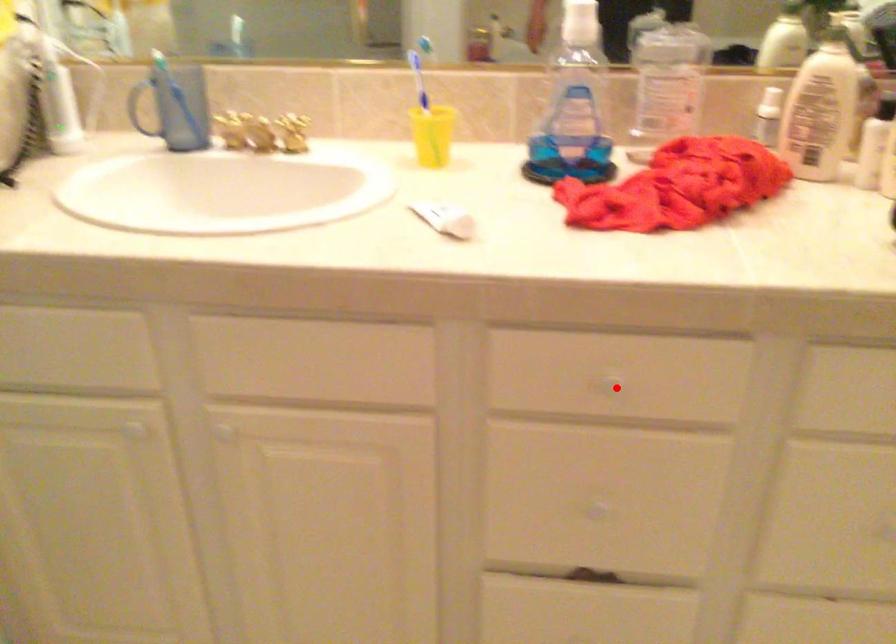
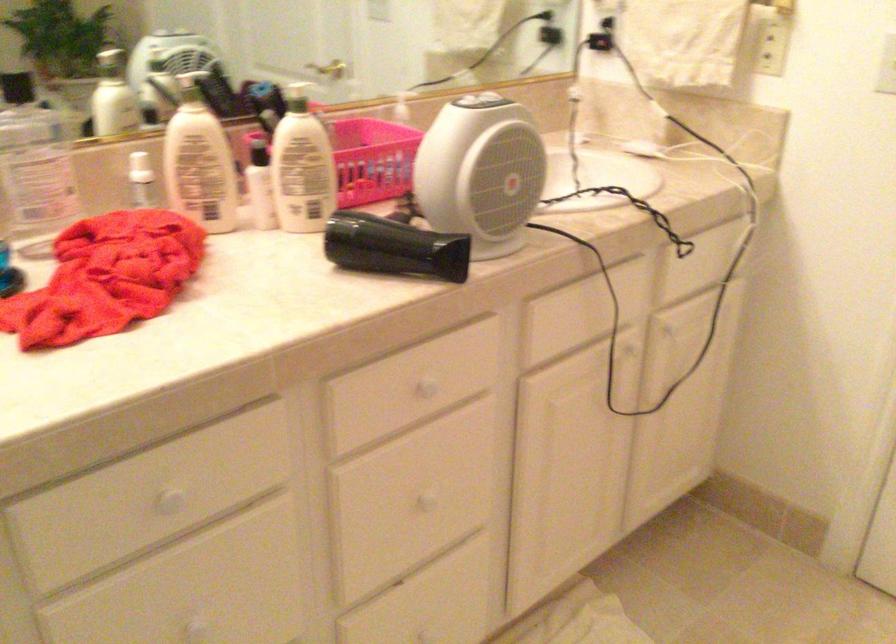
Question: I am providing you with two images of the same scene from different viewpoints. In image1, a red point is highlighted. Considering the same 3D point in image2, which of the following is correct?

Choices:
 (A) It is closer
 (B) It is farther

Answer: (A)